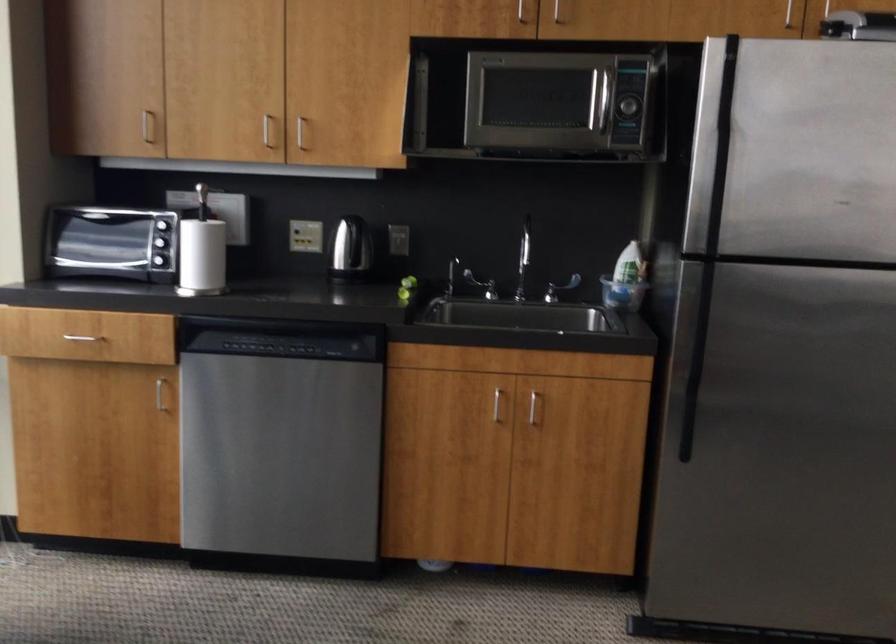
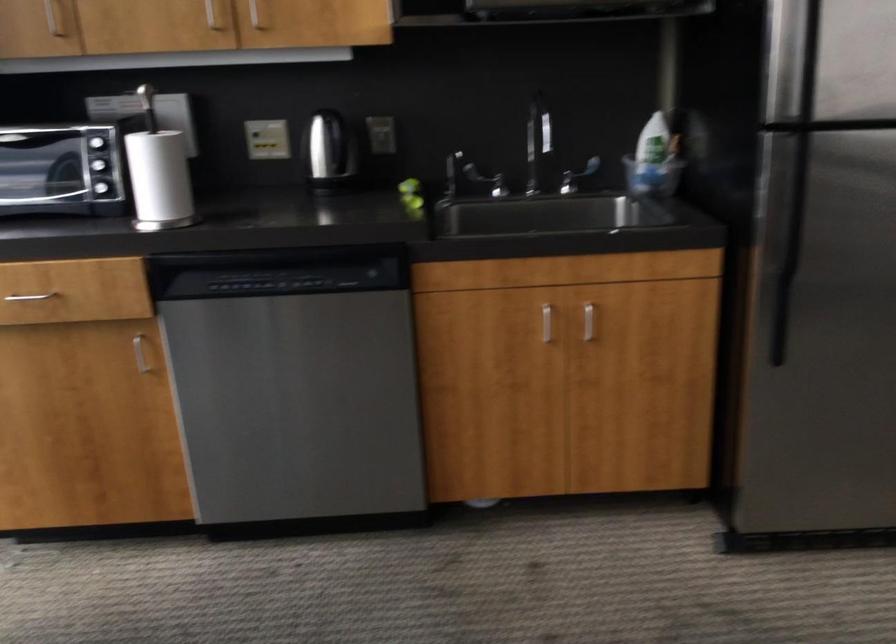
Locate, in the second image, the point that corresponds to point 161,393 in the first image.

(140, 354)